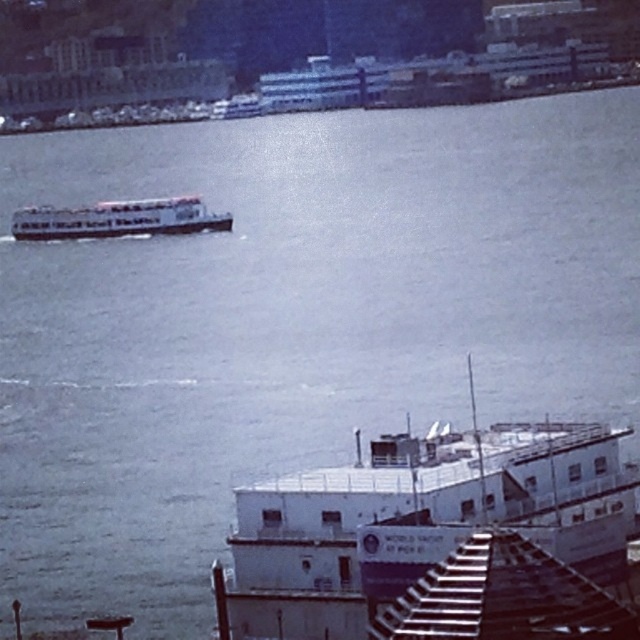
Question: Which point is farther to the camera?

Choices:
 (A) (419, 477)
 (B) (80, 230)

Answer: (B)

Question: Can you confirm if white matte boat at lower right is positioned above white matte boat at upper left?

Choices:
 (A) yes
 (B) no

Answer: (B)

Question: Does white matte boat at lower right have a smaller size compared to white matte boat at upper left?

Choices:
 (A) yes
 (B) no

Answer: (B)

Question: Is white matte boat at lower right above white matte boat at upper left?

Choices:
 (A) yes
 (B) no

Answer: (B)

Question: Which point is farther to the camera?

Choices:
 (A) (13, 228)
 (B) (298, 481)

Answer: (A)